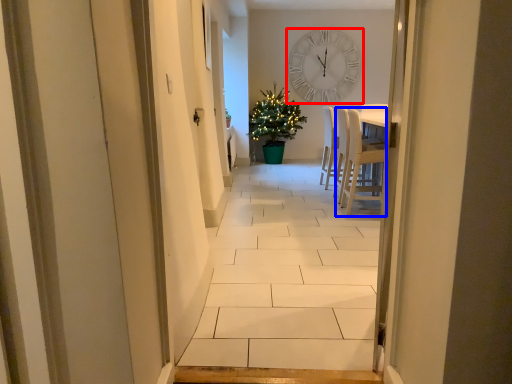
Question: Which of the following is the farthest to the observer, wall clock (highlighted by a red box) or chair (highlighted by a blue box)?

Choices:
 (A) wall clock
 (B) chair

Answer: (A)